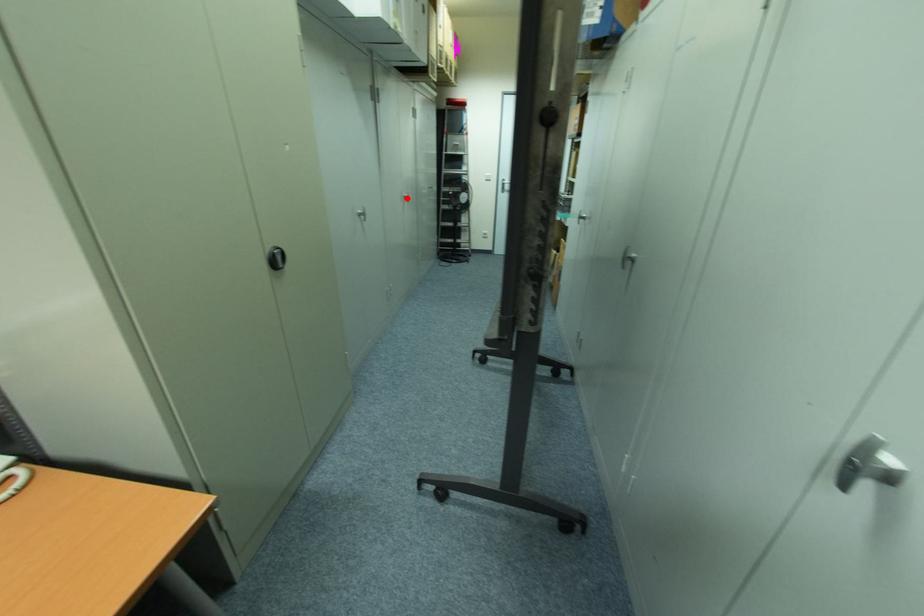
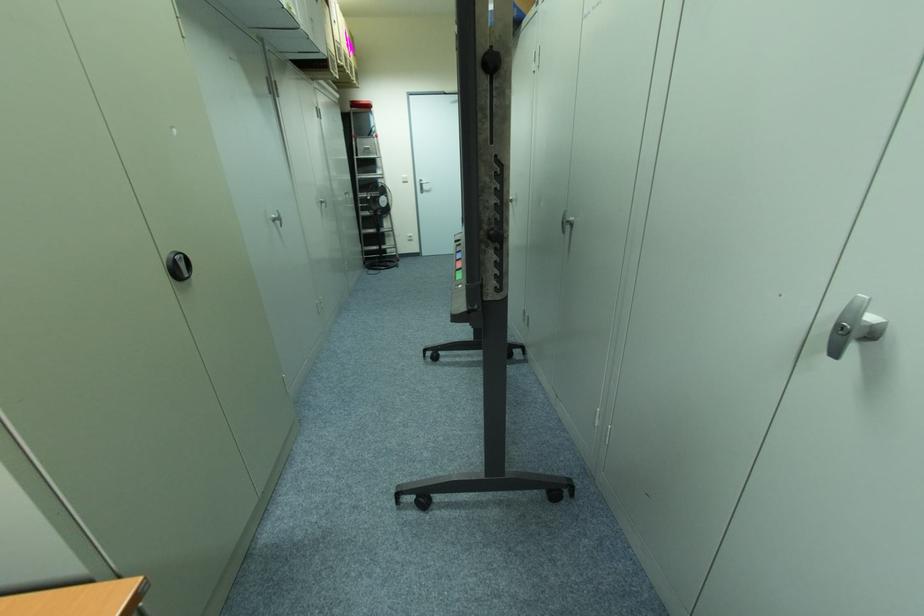
Find the pixel in the second image that matches the highlighted location in the first image.

(322, 203)